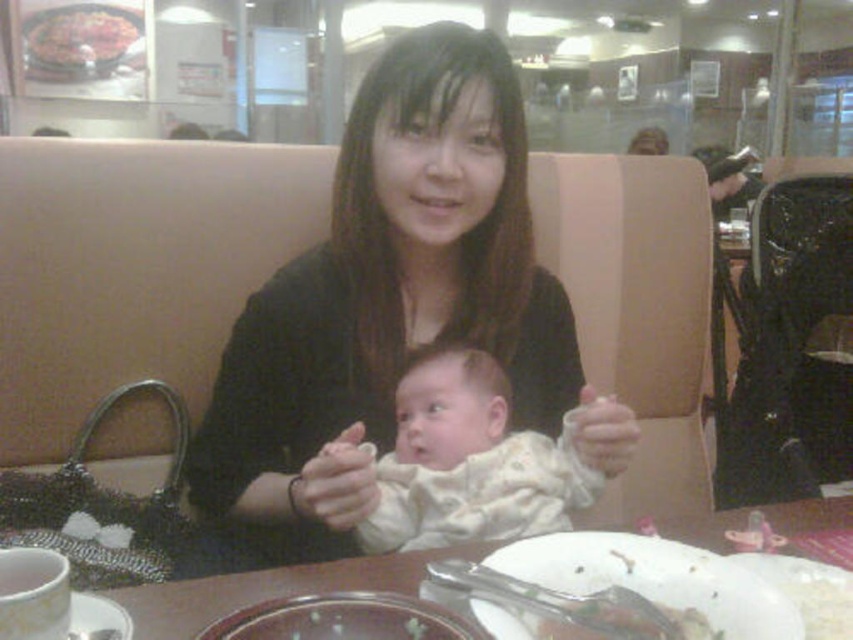
You are a waiter in a restaurant and need to clear the dishes. You see the transparent glass plate at center and the shiny metallic plate at upper left. Which plate should you take first if you want to start with the smaller one?

You should take the transparent glass plate at center first because it is smaller than the shiny metallic plate at upper left.

You are a photographer trying to capture a candid shot of the white soft baby at center without obstructing the view. Since the black matte shirt at center is in the way, where should you position yourself relative to the baby?

The black matte shirt at center is in front of the white soft baby at center, so you should position yourself behind the baby to avoid the obstruction caused by the shirt.

You are a parent trying to place a baby carrier on the wooden table at center. The shiny metallic plate at upper left is in the way. Can you place the carrier on the table without moving the plate?

The wooden table at center is not as tall as shiny metallic plate at upper left, meaning the plate is taller. Since the plate is on the table, it might block the space needed for the carrier. Therefore, you cannot place the carrier on the wooden table at center without moving the shiny metallic plate at upper left.